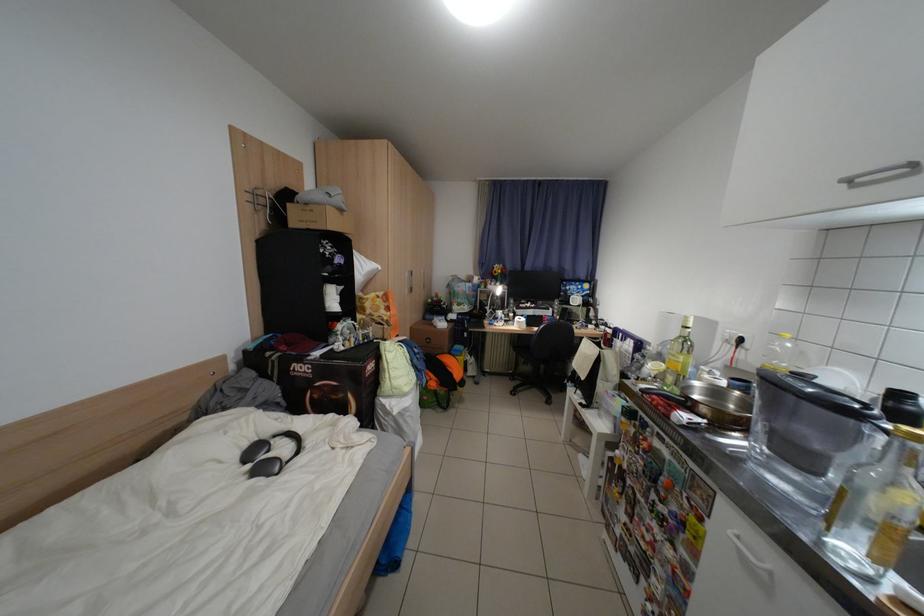
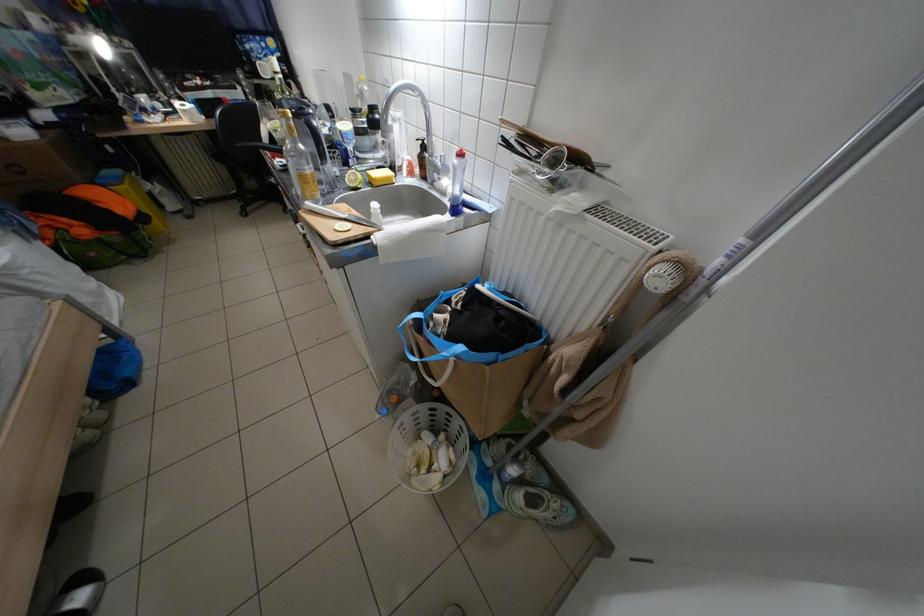
The first image is from the beginning of the video and the second image is from the end. How did the camera likely rotate when shooting the video?

The camera's rotation is toward right-down.